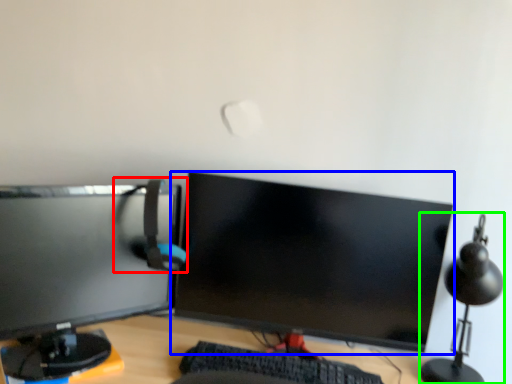
Question: Which object is the farthest from computer chair (highlighted by a red box)? Choose among these: computer monitor (highlighted by a blue box) or table lamp (highlighted by a green box).

Choices:
 (A) computer monitor
 (B) table lamp

Answer: (B)